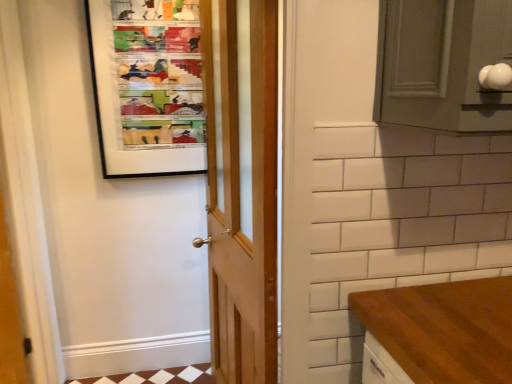
You are a GUI agent. You are given a task and a screenshot of the screen. Output one action in this format:
    pyautogui.click(x=<x>, y=<y>)
    Task: Click on the matte plastic bulletin board at upper left
    
    Given the screenshot: What is the action you would take?
    pyautogui.click(x=147, y=86)

Measure the distance between point [148,24] and camera.

The distance of point [148,24] from camera is 6.04 feet.

What do you see at coordinates (147, 86) in the screenshot? I see `matte plastic bulletin board at upper left` at bounding box center [147, 86].

What do you see at coordinates (241, 189) in the screenshot? I see `wooden door at center` at bounding box center [241, 189].

I want to click on wooden door at center, so click(241, 189).

I want to click on matte plastic bulletin board at upper left, so click(147, 86).

Visually, is matte plastic bulletin board at upper left positioned to the left or to the right of wooden door at center?

matte plastic bulletin board at upper left is positioned on wooden door at center's left side.

Does matte plastic bulletin board at upper left lie in front of wooden door at center?

No, it is behind wooden door at center.

Between point (179, 38) and point (205, 53), which one is positioned behind?

Point (179, 38)

From the image's perspective, who appears lower, matte plastic bulletin board at upper left or wooden door at center?

From the image's view, wooden door at center is below.

In the scene shown: From a real-world perspective, is matte plastic bulletin board at upper left below wooden door at center?

No.

Is matte plastic bulletin board at upper left thinner than wooden door at center?

Yes, matte plastic bulletin board at upper left is thinner than wooden door at center.

Considering the relative sizes of matte plastic bulletin board at upper left and wooden door at center in the image provided, is matte plastic bulletin board at upper left shorter than wooden door at center?

Indeed, matte plastic bulletin board at upper left has a lesser height compared to wooden door at center.

Considering the sizes of objects matte plastic bulletin board at upper left and wooden door at center in the image provided, who is smaller, matte plastic bulletin board at upper left or wooden door at center?

With smaller size is matte plastic bulletin board at upper left.

Would you say wooden door at center is part of matte plastic bulletin board at upper left's contents?

Definitely not — wooden door at center is not inside matte plastic bulletin board at upper left.

In the scene shown: Are matte plastic bulletin board at upper left and wooden door at center located far from each other?

matte plastic bulletin board at upper left is near wooden door at center, not far away.

Could you tell me if matte plastic bulletin board at upper left is facing wooden door at center?

Yes, matte plastic bulletin board at upper left is aimed at wooden door at center.

How many degrees apart are the facing directions of matte plastic bulletin board at upper left and wooden door at center?

matte plastic bulletin board at upper left and wooden door at center are facing 82.2 degrees away from each other.

Where is `door that appears on the right of matte plastic bulletin board at upper left`? The height and width of the screenshot is (384, 512). door that appears on the right of matte plastic bulletin board at upper left is located at coordinates (241, 189).

Considering the relative positions of wooden door at center and matte plastic bulletin board at upper left in the image provided, is wooden door at center to the left of matte plastic bulletin board at upper left from the viewer's perspective?

In fact, wooden door at center is to the right of matte plastic bulletin board at upper left.

In the image, is wooden door at center positioned in front of or behind matte plastic bulletin board at upper left?

wooden door at center is positioned closer to the viewer than matte plastic bulletin board at upper left.

Is point (258, 176) closer or farther from the camera than point (144, 101)?

Point (258, 176) appears to be closer to the viewer than point (144, 101).

From the image's perspective, is wooden door at center above or below matte plastic bulletin board at upper left?

wooden door at center is situated lower than matte plastic bulletin board at upper left in the image.

In the scene shown: From a real-world perspective, is wooden door at center physically below matte plastic bulletin board at upper left?

Yes, from a real-world perspective, wooden door at center is beneath matte plastic bulletin board at upper left.

Considering the sizes of objects wooden door at center and matte plastic bulletin board at upper left in the image provided, who is wider, wooden door at center or matte plastic bulletin board at upper left?

Wider between the two is wooden door at center.

Is wooden door at center shorter than matte plastic bulletin board at upper left?

No, wooden door at center is not shorter than matte plastic bulletin board at upper left.

Considering the sizes of objects wooden door at center and matte plastic bulletin board at upper left in the image provided, who is smaller, wooden door at center or matte plastic bulletin board at upper left?

Smaller between the two is matte plastic bulletin board at upper left.

Is wooden door at center outside of matte plastic bulletin board at upper left?

Yes, wooden door at center is located beyond the bounds of matte plastic bulletin board at upper left.

Are wooden door at center and matte plastic bulletin board at upper left located far from each other?

No, wooden door at center is not far from matte plastic bulletin board at upper left.

Is matte plastic bulletin board at upper left at the back of wooden door at center?

No, matte plastic bulletin board at upper left is not at the back of wooden door at center.

Can you tell me how much wooden door at center and matte plastic bulletin board at upper left differ in facing direction?

82.2 degrees.

What are the coordinates of `door on the right of matte plastic bulletin board at upper left` in the screenshot? It's located at (241, 189).

Identify the location of bulletin board located behind the wooden door at center. (147, 86).

Identify the location of door below the matte plastic bulletin board at upper left (from the image's perspective). The height and width of the screenshot is (384, 512). (241, 189).